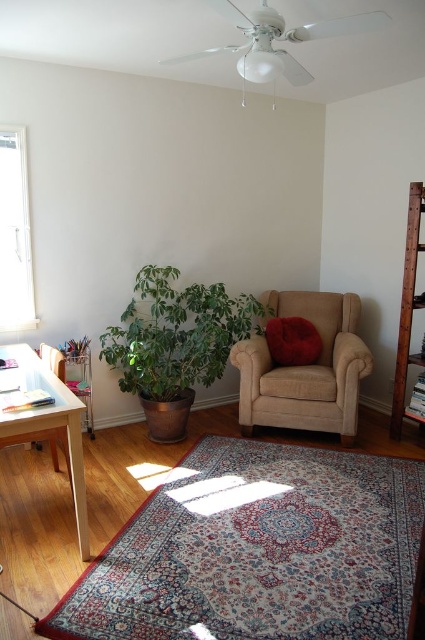
Question: Among these objects, which one is nearest to the camera?

Choices:
 (A) green leafy plant at lower left
 (B) suede beige armchair at center
 (C) brown wooden bookshelf at right
 (D) clear glass window at left

Answer: (D)

Question: Can you confirm if suede beige armchair at center is positioned to the left of brown wooden bookshelf at right?

Choices:
 (A) yes
 (B) no

Answer: (A)

Question: Does clear glass window at left have a larger size compared to brown wooden bookshelf at right?

Choices:
 (A) yes
 (B) no

Answer: (B)

Question: Which point is closer to the camera taking this photo?

Choices:
 (A) (107, 362)
 (B) (0, 211)
 (C) (340, 378)

Answer: (B)

Question: Can you confirm if brown wooden bookshelf at right is positioned below velvet red pillow at center?

Choices:
 (A) no
 (B) yes

Answer: (A)

Question: Considering the real-world distances, which object is farthest from the clear glass window at left?

Choices:
 (A) green leafy plant at lower left
 (B) suede beige armchair at center
 (C) velvet red pillow at center
 (D) light wood table at left

Answer: (B)